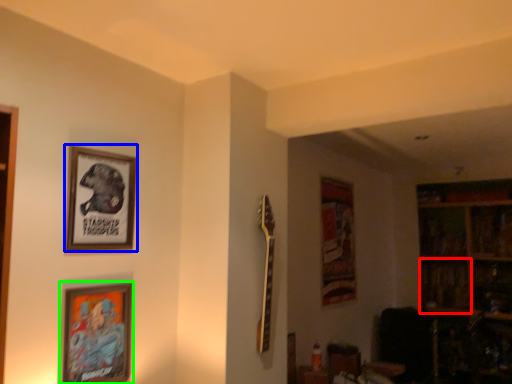
Question: Which is nearer to the shelf (highlighted by a red box)? picture frame (highlighted by a blue box) or picture frame (highlighted by a green box).

Choices:
 (A) picture frame
 (B) picture frame

Answer: (B)